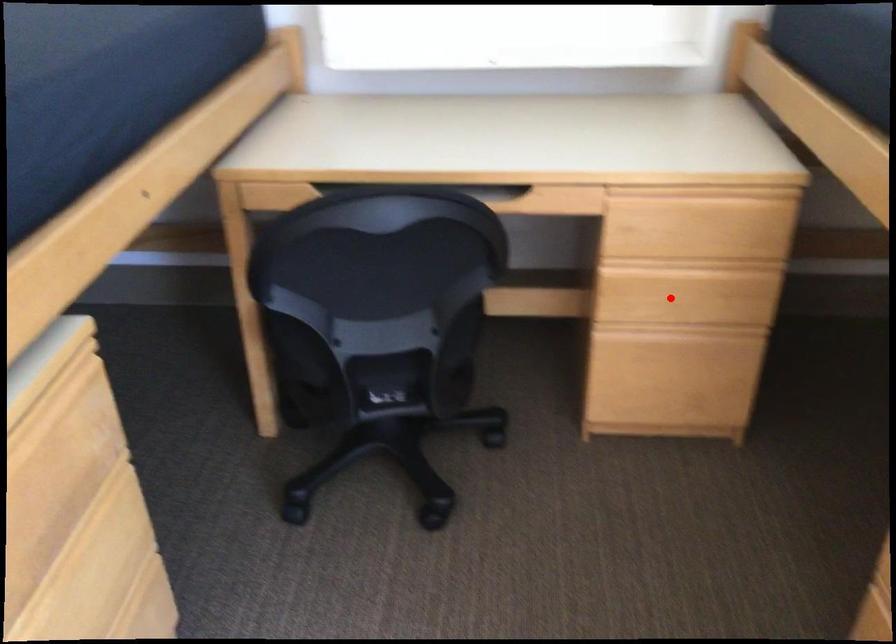
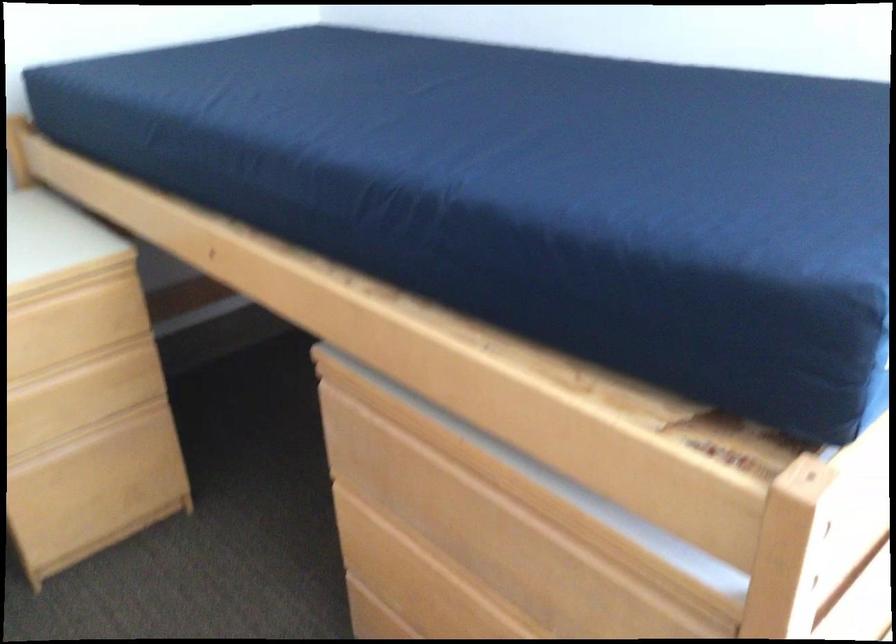
The point at the highlighted location is marked in the first image. Where is the corresponding point in the second image?

(65, 410)